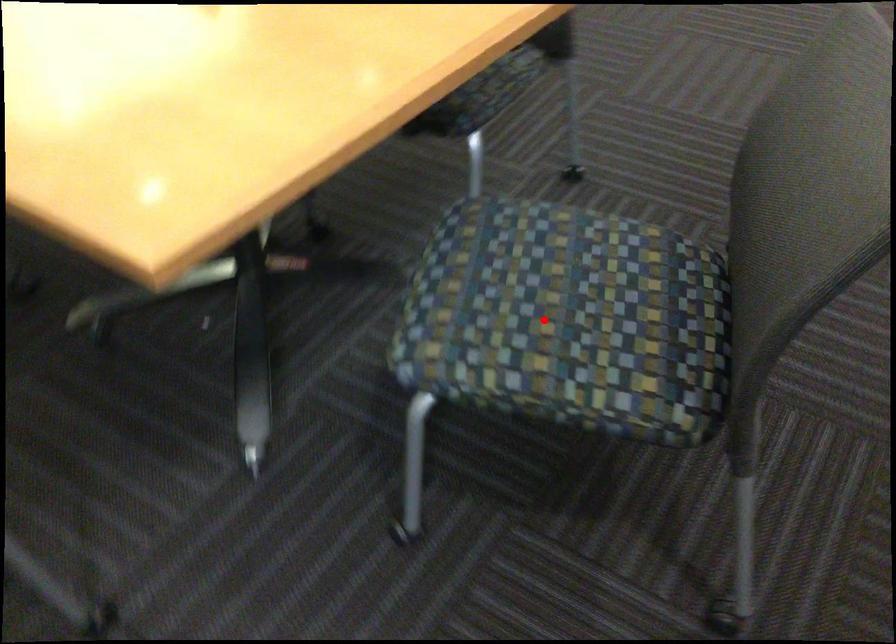
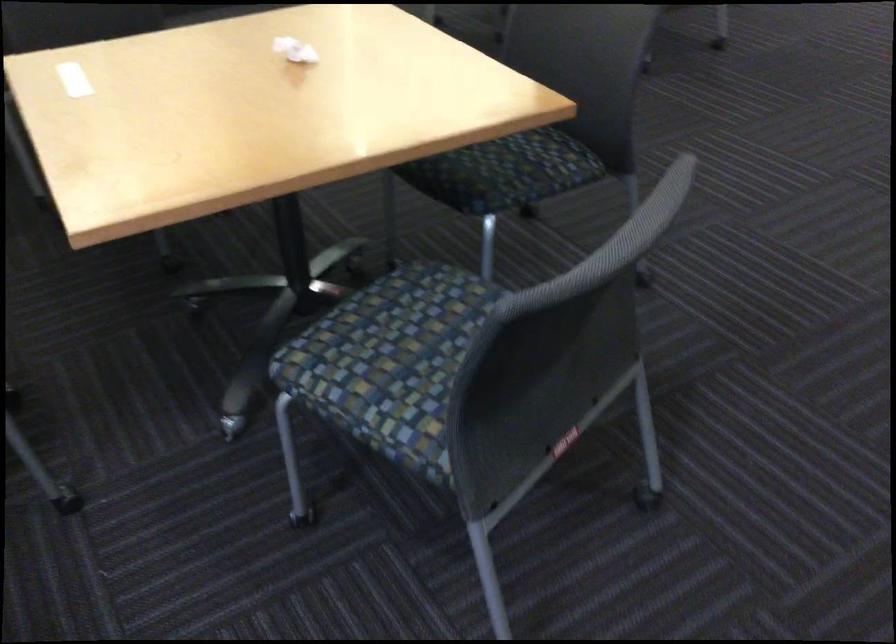
Where in the second image is the point corresponding to the highlighted location from the first image?

(391, 361)